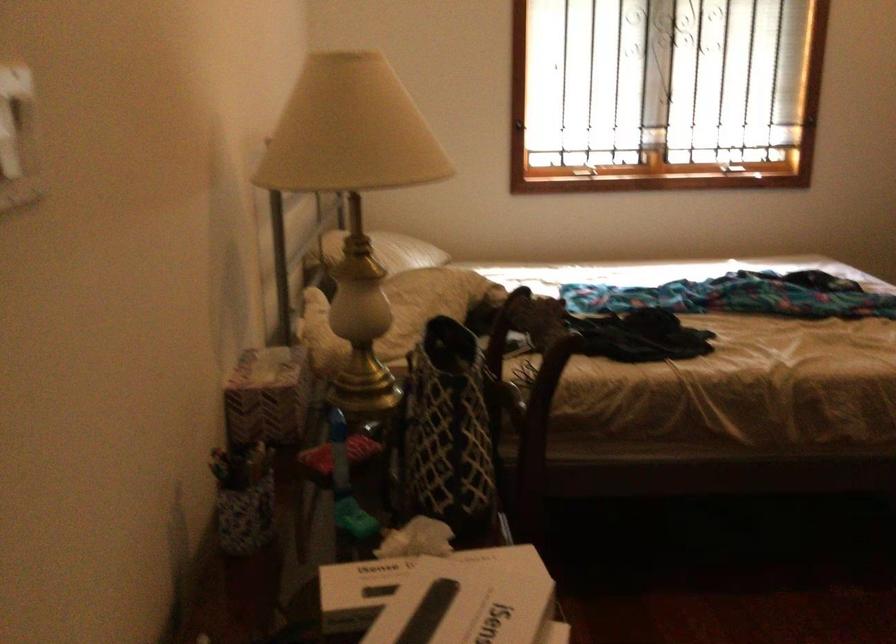
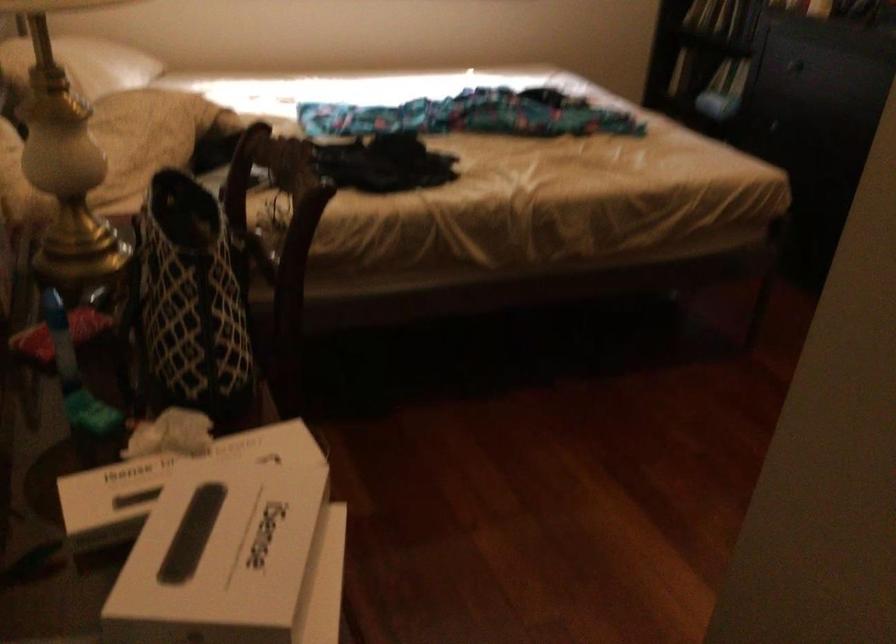
Find the pixel in the second image that matches [443,424] in the first image.

(188, 301)